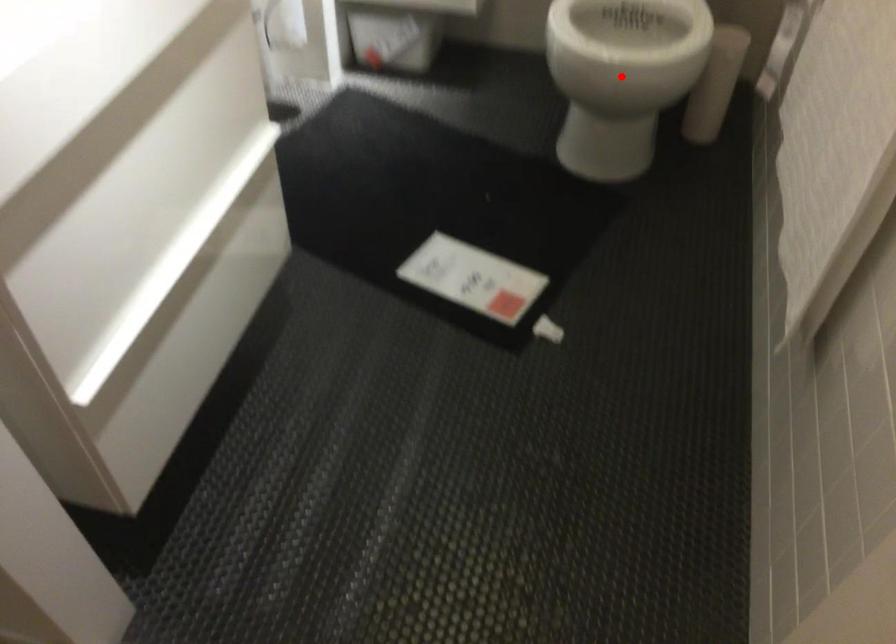
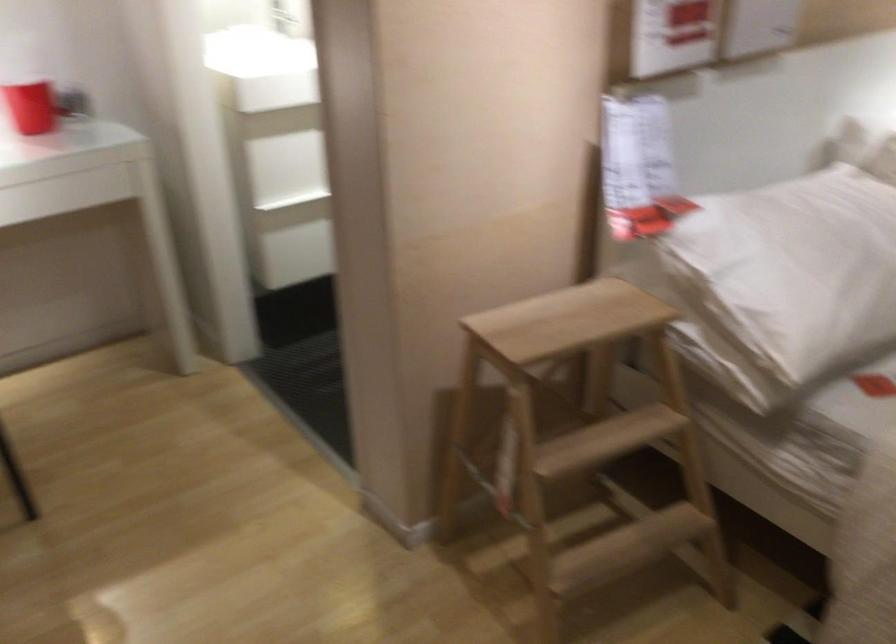
Question: I am providing you with two images of the same scene from different viewpoints. A red point is marked on the first image. Is the red point's position out of view in image 2?

Choices:
 (A) Yes
 (B) No

Answer: (A)